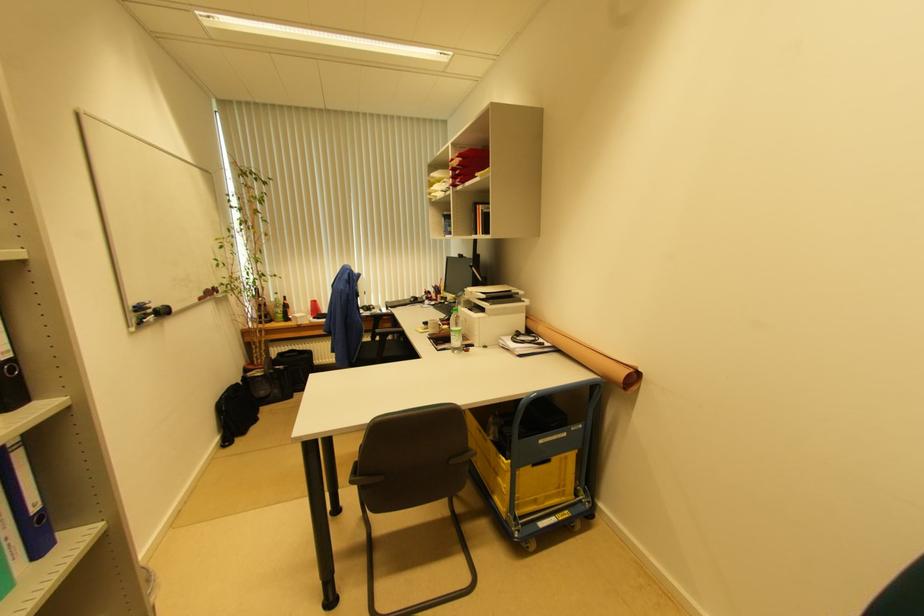
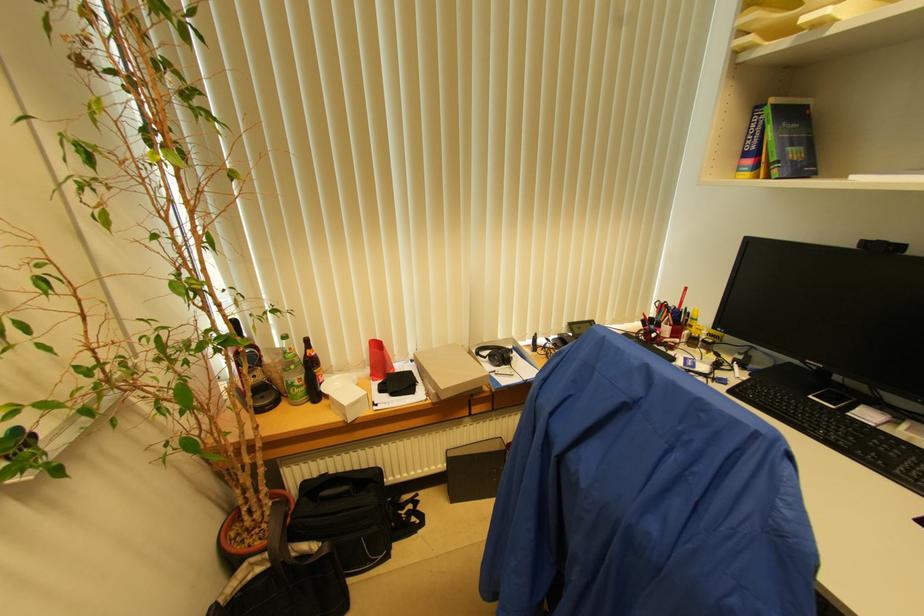
Where in the second image is the point corresponding to pixel 284 313 from the first image?

(304, 379)